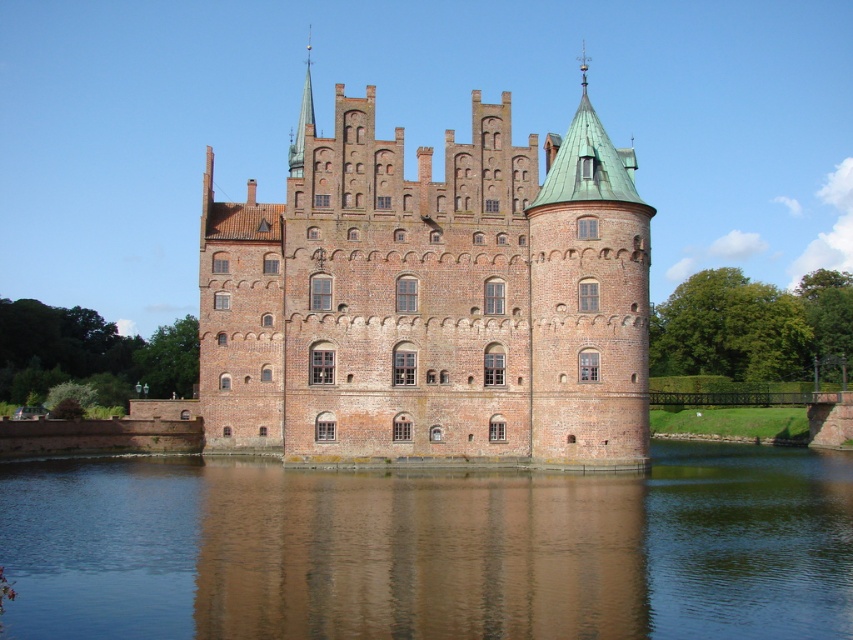
Can you confirm if brown reflective water at center is positioned above brown brick castle at center?

Incorrect, brown reflective water at center is not positioned above brown brick castle at center.

Which is more to the left, brown reflective water at center or brown brick castle at center?

Positioned to the left is brown brick castle at center.

Between point (676, 628) and point (367, 308), which one is positioned in front?

Point (676, 628) is more forward.

The width and height of the screenshot is (853, 640). Find the location of `brown reflective water at center`. brown reflective water at center is located at coordinates (431, 548).